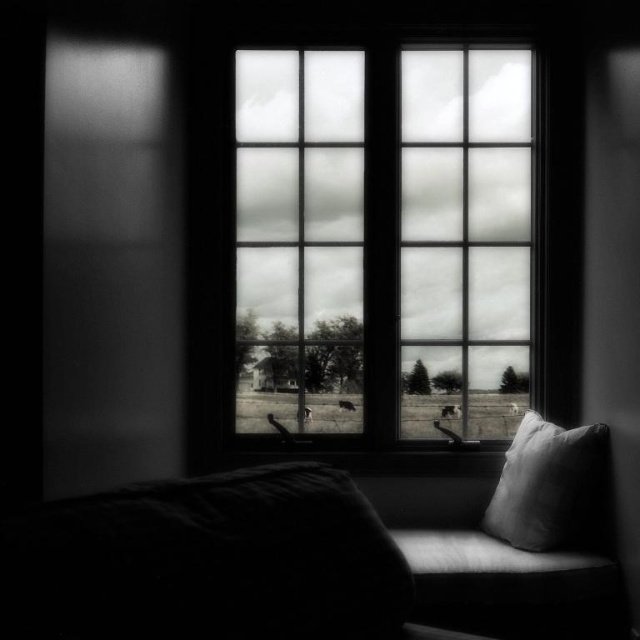
Question: Which object appears closest to the camera in this image?

Choices:
 (A) clear glass window at center
 (B) dark fabric at lower left

Answer: (B)

Question: Which point is farther from the camera taking this photo?

Choices:
 (A) (262, 515)
 (B) (529, 445)
 (C) (346, 172)

Answer: (C)

Question: Does clear glass window at center appear under white soft pillow at lower right?

Choices:
 (A) no
 (B) yes

Answer: (A)

Question: Is clear glass window at center smaller than dark fabric at lower left?

Choices:
 (A) yes
 (B) no

Answer: (B)

Question: Is dark fabric at lower left further to camera compared to white soft pillow at lower right?

Choices:
 (A) yes
 (B) no

Answer: (B)

Question: Which object is positioned closest to the clear glass window at center?

Choices:
 (A) dark fabric at lower left
 (B) white soft pillow at lower right

Answer: (B)